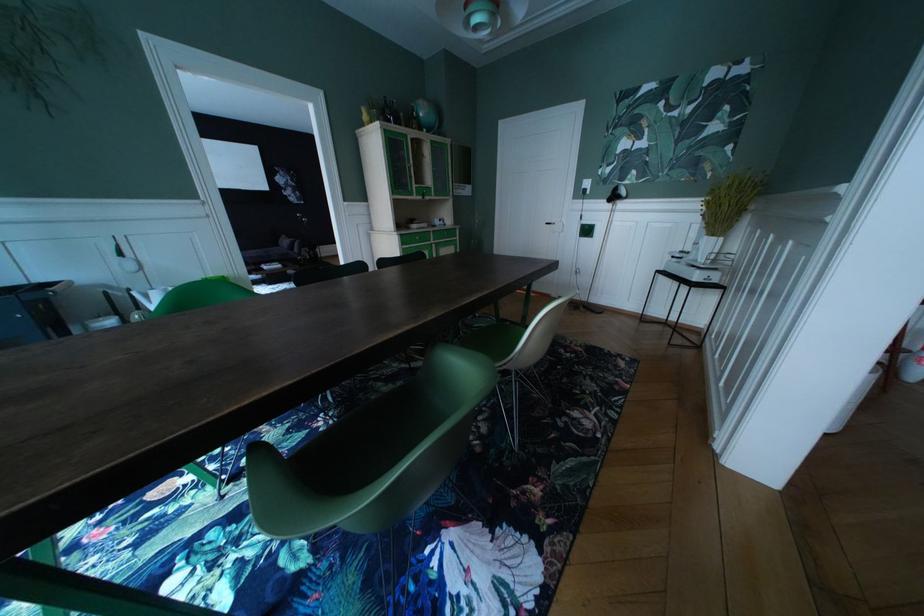
Image resolution: width=924 pixels, height=616 pixels. What do you see at coordinates (553, 230) in the screenshot?
I see `the cabinet drawer handle` at bounding box center [553, 230].